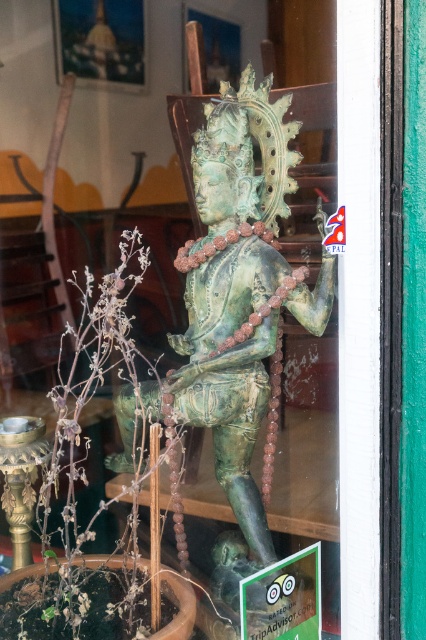
You are a delivery person who needs to place a package between the green patina statue at center and the green leafy plant at center. The package is 8 inches long. Will the space between them be sufficient to fit the package?

The distance between the green patina statue at center and the green leafy plant at center is 7.64 inches, which is slightly less than the 8 inch package. Therefore, the space is not sufficient to fit the package.

You are standing in front of the green patina statue at center and want to take a photo of it without any obstructions. Since the statue is 1.00 meters away from the camera, what is the minimum distance you should stand behind the statue to ensure the entire statue fits in your camera frame?

The green patina statue at center is 1.00 meters away from the camera. To ensure the entire statue fits in the camera frame without obstructions, you should stand at least 1.00 meters behind the statue.

You are standing in front of the statue and want to place a small vase on the floor. The vase needs to be placed exactly 0.3 meters to the right of the green patina statue at center. Where should you place the vase relative to the statue?

The vase should be placed 0.3 meters to the right of the green patina statue at center, as specified.